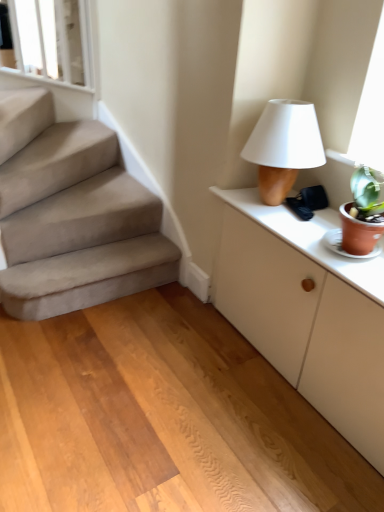
Question: Could you tell me if white glossy window frame at upper left is turned towards matte brown table lamp at upper right?

Choices:
 (A) no
 (B) yes

Answer: (A)

Question: Is white glossy window frame at upper left completely or partially outside of matte brown table lamp at upper right?

Choices:
 (A) yes
 (B) no

Answer: (A)

Question: Can you confirm if white glossy window frame at upper left is taller than matte brown table lamp at upper right?

Choices:
 (A) no
 (B) yes

Answer: (B)

Question: Is matte brown table lamp at upper right completely or partially inside white glossy window frame at upper left?

Choices:
 (A) no
 (B) yes

Answer: (A)

Question: Considering the relative positions of white glossy window frame at upper left and matte brown table lamp at upper right in the image provided, is white glossy window frame at upper left to the right of matte brown table lamp at upper right from the viewer's perspective?

Choices:
 (A) yes
 (B) no

Answer: (B)

Question: Choose the correct answer: Is white matte cabinet at right inside wooden floor at center or outside it?

Choices:
 (A) outside
 (B) inside

Answer: (A)

Question: Is white matte cabinet at right in front of or behind wooden floor at center in the image?

Choices:
 (A) behind
 (B) front

Answer: (A)

Question: Is point (269, 224) closer or farther from the camera than point (253, 391)?

Choices:
 (A) closer
 (B) farther

Answer: (A)

Question: Is white matte cabinet at right bigger or smaller than wooden floor at center?

Choices:
 (A) big
 (B) small

Answer: (B)

Question: From the image's perspective, is matte brown table lamp at upper right above or below white glossy window frame at upper left?

Choices:
 (A) below
 (B) above

Answer: (A)

Question: Is matte brown table lamp at upper right taller or shorter than white glossy window frame at upper left?

Choices:
 (A) short
 (B) tall

Answer: (A)

Question: In the image, is matte brown table lamp at upper right positioned in front of or behind white glossy window frame at upper left?

Choices:
 (A) behind
 (B) front

Answer: (B)

Question: Considering the positions of matte brown table lamp at upper right and white glossy window frame at upper left in the image, is matte brown table lamp at upper right bigger or smaller than white glossy window frame at upper left?

Choices:
 (A) small
 (B) big

Answer: (A)

Question: Based on their positions, is matte brown table lamp at upper right located to the left or right of wooden floor at center?

Choices:
 (A) right
 (B) left

Answer: (A)

Question: In terms of size, does matte brown table lamp at upper right appear bigger or smaller than wooden floor at center?

Choices:
 (A) small
 (B) big

Answer: (A)